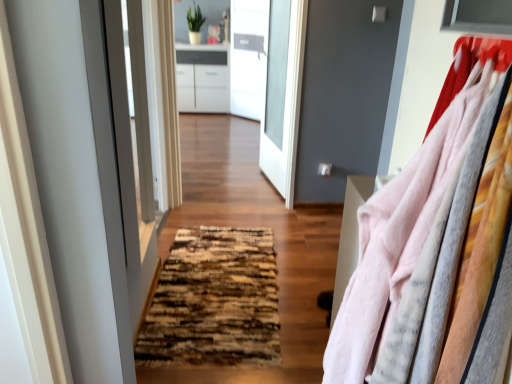
Question: Could white glossy cabinet at upper center be considered to be inside brown textured rug at center?

Choices:
 (A) yes
 (B) no

Answer: (B)

Question: Is brown textured rug at center facing towards white glossy cabinet at upper center?

Choices:
 (A) no
 (B) yes

Answer: (A)

Question: Can you confirm if brown textured rug at center is positioned to the right of white glossy cabinet at upper center?

Choices:
 (A) yes
 (B) no

Answer: (B)

Question: Considering the relative sizes of brown textured rug at center and white glossy cabinet at upper center in the image provided, is brown textured rug at center shorter than white glossy cabinet at upper center?

Choices:
 (A) no
 (B) yes

Answer: (B)

Question: Is brown textured rug at center looking in the opposite direction of white glossy cabinet at upper center?

Choices:
 (A) yes
 (B) no

Answer: (B)

Question: Does brown textured rug at center appear on the left side of white glossy cabinet at upper center?

Choices:
 (A) yes
 (B) no

Answer: (A)

Question: Could you tell me if white glossy cabinet at upper center is facing transparent glass door at center?

Choices:
 (A) no
 (B) yes

Answer: (A)

Question: From the image's perspective, would you say white glossy cabinet at upper center is positioned over transparent glass door at center?

Choices:
 (A) no
 (B) yes

Answer: (A)

Question: Are white glossy cabinet at upper center and transparent glass door at center far apart?

Choices:
 (A) no
 (B) yes

Answer: (A)

Question: Is white glossy cabinet at upper center positioned in front of transparent glass door at center?

Choices:
 (A) no
 (B) yes

Answer: (B)

Question: Can you confirm if white glossy cabinet at upper center is bigger than transparent glass door at center?

Choices:
 (A) yes
 (B) no

Answer: (A)

Question: From a real-world perspective, is white glossy cabinet at upper center under transparent glass door at center?

Choices:
 (A) yes
 (B) no

Answer: (A)

Question: Can you confirm if matte white screen door at center is shorter than brown textured rug at center?

Choices:
 (A) yes
 (B) no

Answer: (B)